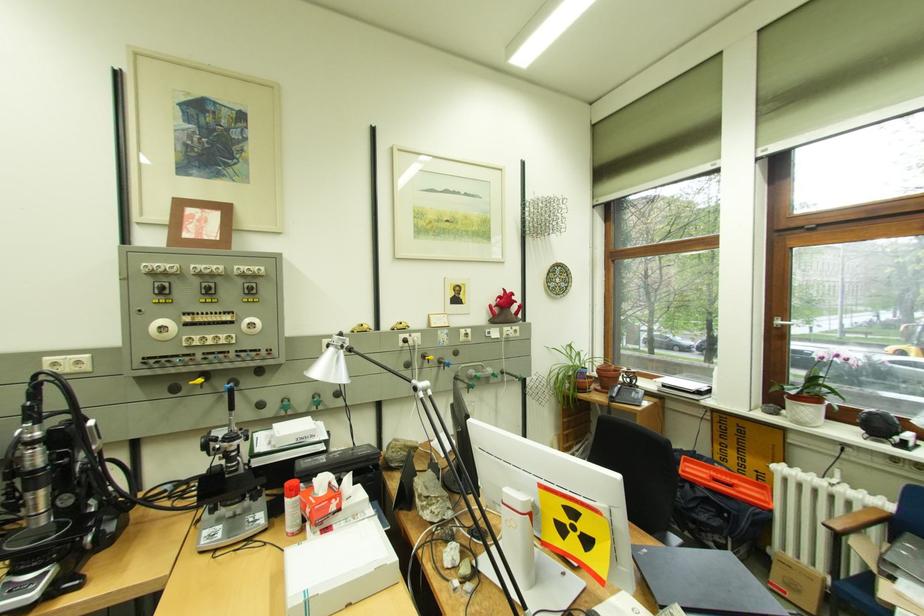
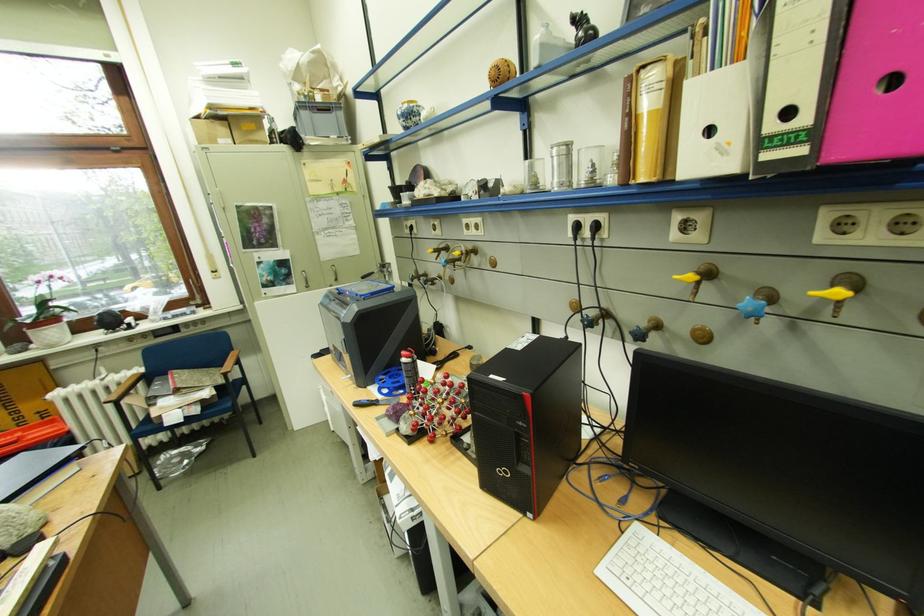
Locate, in the second image, the point that corresponds to (x=798, y=403) in the first image.

(41, 334)